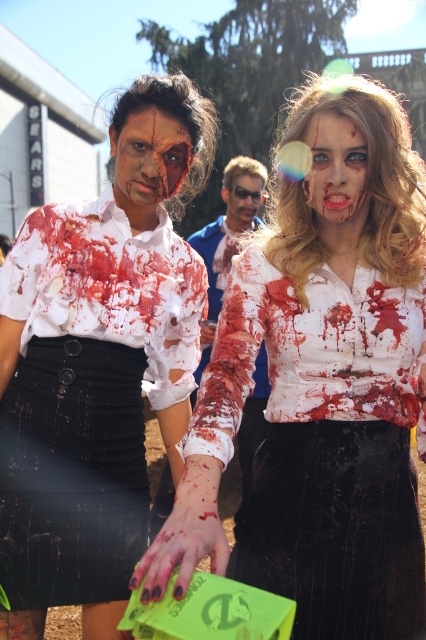
Question: Which object is positioned closest to the matte plastic sunglasses at center?

Choices:
 (A) ripped white shirt at center
 (B) matte white face at center
 (C) blood-stained makeup at center
 (D) matte white blouse at center

Answer: (B)

Question: Is blood-stained makeup at center further to camera compared to matte white face at center?

Choices:
 (A) yes
 (B) no

Answer: (B)

Question: Which object is positioned farthest from the ripped white shirt at center?

Choices:
 (A) matte white face at center
 (B) blood-stained makeup at center
 (C) matte white blouse at center

Answer: (B)

Question: Can you confirm if matte white blouse at center is positioned to the left of ripped white shirt at center?

Choices:
 (A) no
 (B) yes

Answer: (A)

Question: Does matte white blouse at center have a greater width compared to matte white face at center?

Choices:
 (A) yes
 (B) no

Answer: (A)

Question: Considering the real-world distances, which object is closest to the blood-stained makeup at center?

Choices:
 (A) matte white face at center
 (B) matte plastic sunglasses at center
 (C) ripped white shirt at center

Answer: (A)